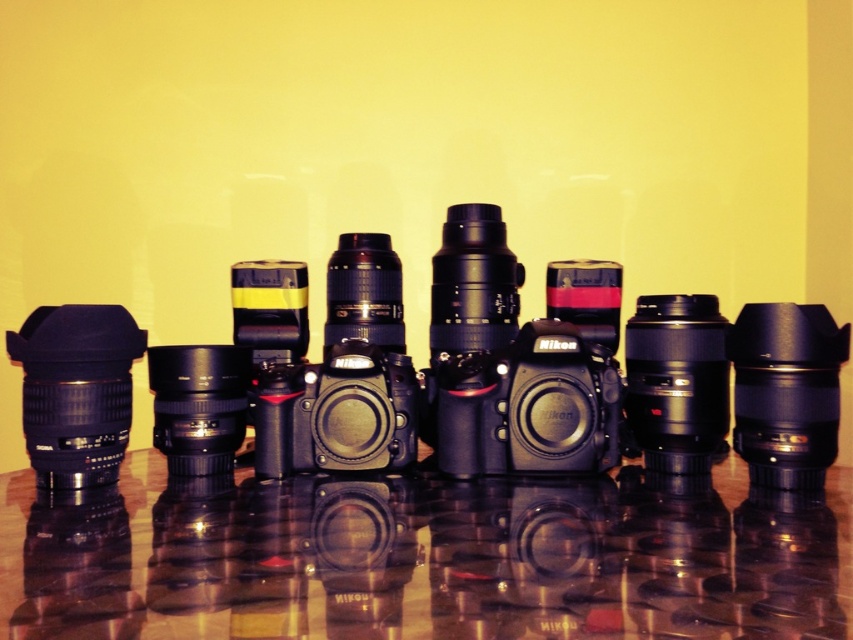
Is matte black camera at center thinner than matte black lens at left?

No, matte black camera at center is not thinner than matte black lens at left.

Describe the element at coordinates (439, 376) in the screenshot. I see `matte black camera at center` at that location.

Who is more distant from viewer, (154, 444) or (78, 365)?

The point (154, 444) is behind.

Find the location of a particular element. matte black camera at center is located at coordinates (439, 376).

Which is in front, point (532, 385) or point (463, 582)?

Point (463, 582)

The width and height of the screenshot is (853, 640). Find the location of `matte black camera at center`. matte black camera at center is located at coordinates (439, 376).

Is glossy reflective table at center closer to the viewer compared to matte black lens at left?

Yes, it is in front of matte black lens at left.

Can you confirm if glossy reflective table at center is wider than matte black lens at left?

Correct, the width of glossy reflective table at center exceeds that of matte black lens at left.

Where is `glossy reflective table at center`? Image resolution: width=853 pixels, height=640 pixels. glossy reflective table at center is located at coordinates (426, 557).